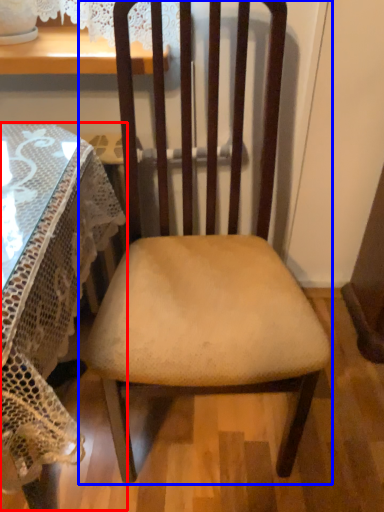
Question: Which of the following is the farthest to the observer, table (highlighted by a red box) or chair (highlighted by a blue box)?

Choices:
 (A) table
 (B) chair

Answer: (B)